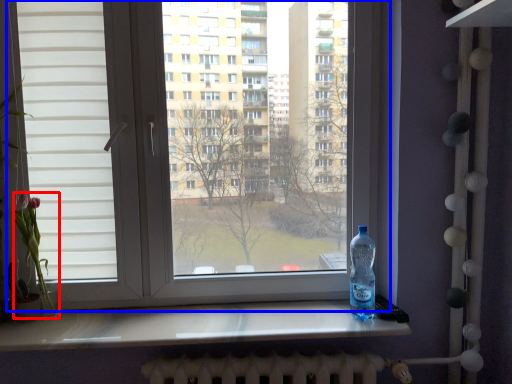
Question: Which object appears farthest to the camera in this image, flower (highlighted by a red box) or window (highlighted by a blue box)?

Choices:
 (A) flower
 (B) window

Answer: (A)